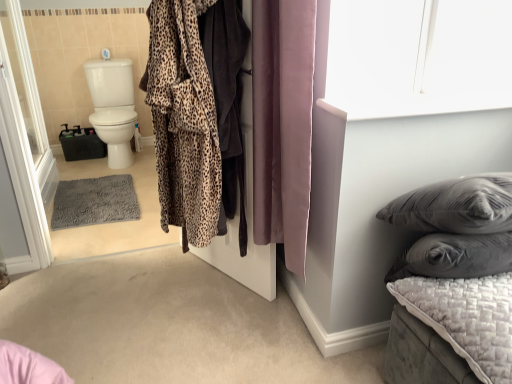
Question: Does leopard print robe at center come behind purple velvet curtain at center?

Choices:
 (A) no
 (B) yes

Answer: (B)

Question: Can you confirm if leopard print robe at center is positioned to the right of purple velvet curtain at center?

Choices:
 (A) yes
 (B) no

Answer: (B)

Question: Is purple velvet curtain at center at the back of leopard print robe at center?

Choices:
 (A) no
 (B) yes

Answer: (B)

Question: Is leopard print robe at center taller than purple velvet curtain at center?

Choices:
 (A) no
 (B) yes

Answer: (B)

Question: Does leopard print robe at center have a larger size compared to purple velvet curtain at center?

Choices:
 (A) no
 (B) yes

Answer: (A)

Question: From the image's perspective, is leopard print robe at center on top of purple velvet curtain at center?

Choices:
 (A) no
 (B) yes

Answer: (B)

Question: Considering the relative sizes of leopard print plush bathrobe at center and transparent glass screen door at left in the image provided, is leopard print plush bathrobe at center taller than transparent glass screen door at left?

Choices:
 (A) yes
 (B) no

Answer: (B)

Question: From the image's perspective, is leopard print plush bathrobe at center below transparent glass screen door at left?

Choices:
 (A) yes
 (B) no

Answer: (A)

Question: Is leopard print plush bathrobe at center behind transparent glass screen door at left?

Choices:
 (A) yes
 (B) no

Answer: (B)

Question: Are leopard print plush bathrobe at center and transparent glass screen door at left beside each other?

Choices:
 (A) no
 (B) yes

Answer: (A)

Question: Is leopard print plush bathrobe at center thinner than transparent glass screen door at left?

Choices:
 (A) no
 (B) yes

Answer: (A)

Question: From a real-world perspective, is leopard print plush bathrobe at center located higher than transparent glass screen door at left?

Choices:
 (A) yes
 (B) no

Answer: (A)

Question: Is quilted gray cushion at lower right positioned far away from purple velvet curtain at center?

Choices:
 (A) no
 (B) yes

Answer: (A)